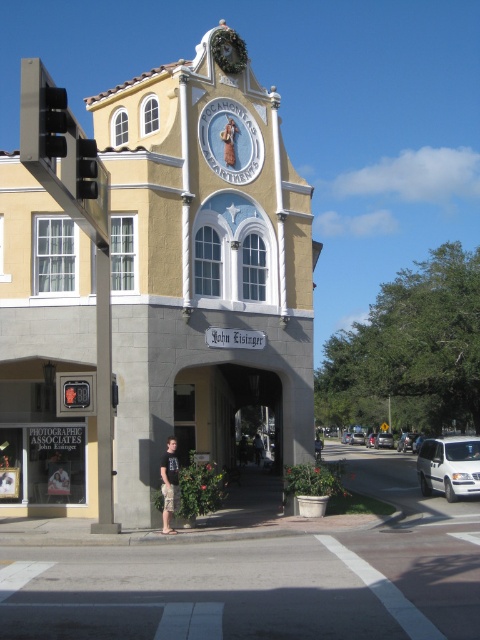
Does matte white clock at center have a greater width compared to brown textured shorts at lower center?

Incorrect, matte white clock at center's width does not surpass brown textured shorts at lower center's.

From the picture: Is matte white clock at center taller than brown textured shorts at lower center?

No.

Does point (242, 156) come closer to viewer compared to point (322, 444)?

Yes, it is.

Image resolution: width=480 pixels, height=640 pixels. I want to click on matte white clock at center, so click(230, 140).

Is white matte van at lower right taller than black cotton shirt at center?

Correct, white matte van at lower right is much taller as black cotton shirt at center.

Is point (450, 490) farther from viewer compared to point (168, 440)?

That is True.

Find the location of a particular element. white matte van at lower right is located at coordinates 448,467.

Who is more distant from viewer, (314,451) or (374,436)?

The point (374,436) is more distant.

Does point (315, 442) lie in front of point (367, 438)?

Yes, point (315, 442) is in front of point (367, 438).

Is point (317, 458) farther from viewer compared to point (369, 442)?

No, (317, 458) is closer to viewer.

Find the location of a particular element. Image resolution: width=480 pixels, height=640 pixels. brown textured shorts at lower center is located at coordinates point(317,448).